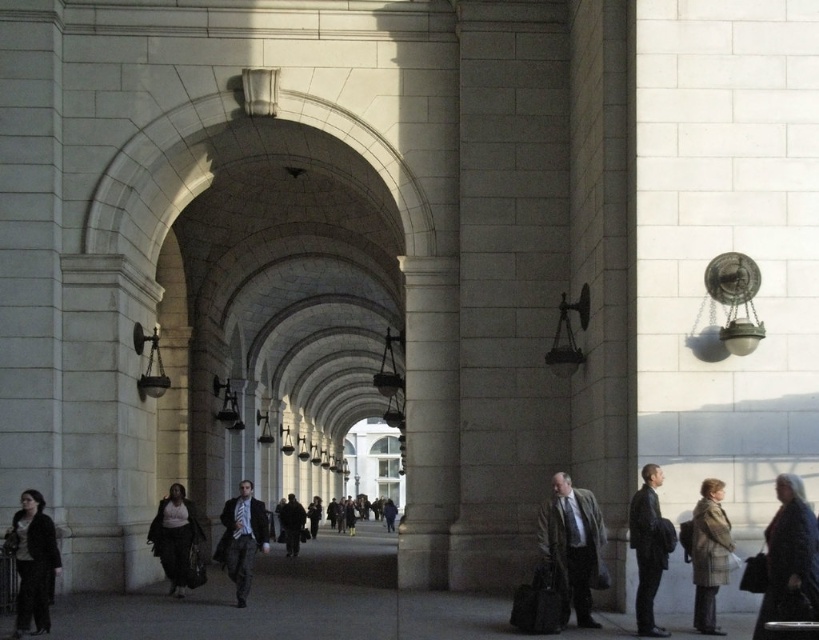
Which of these two, dark gray suit at right or dark gray fabric coat at lower left, stands taller?

dark gray fabric coat at lower left

Who is higher up, dark gray suit at right or dark gray fabric coat at lower left?

dark gray suit at right is higher up.

Locate an element on the screen. The image size is (819, 640). dark gray suit at right is located at coordinates (649, 547).

Can you confirm if dark gray suit at right is positioned to the left of dark brown leather coat at center?

Incorrect, dark gray suit at right is not on the left side of dark brown leather coat at center.

Locate an element on the screen. dark gray suit at right is located at coordinates (649, 547).

Who is more distant from viewer, [666,630] or [283,509]?

Point [283,509]

The image size is (819, 640). I want to click on dark gray suit at right, so click(649, 547).

Does dark gray jacket at lower left have a larger size compared to dark gray suit at right?

No.

Consider the image. Which is more to the right, dark gray jacket at lower left or dark gray suit at right?

dark gray suit at right is more to the right.

Does point (57, 570) come behind point (645, 552)?

Yes, point (57, 570) is farther from viewer.

Image resolution: width=819 pixels, height=640 pixels. Identify the location of dark gray jacket at lower left. [x=32, y=563].